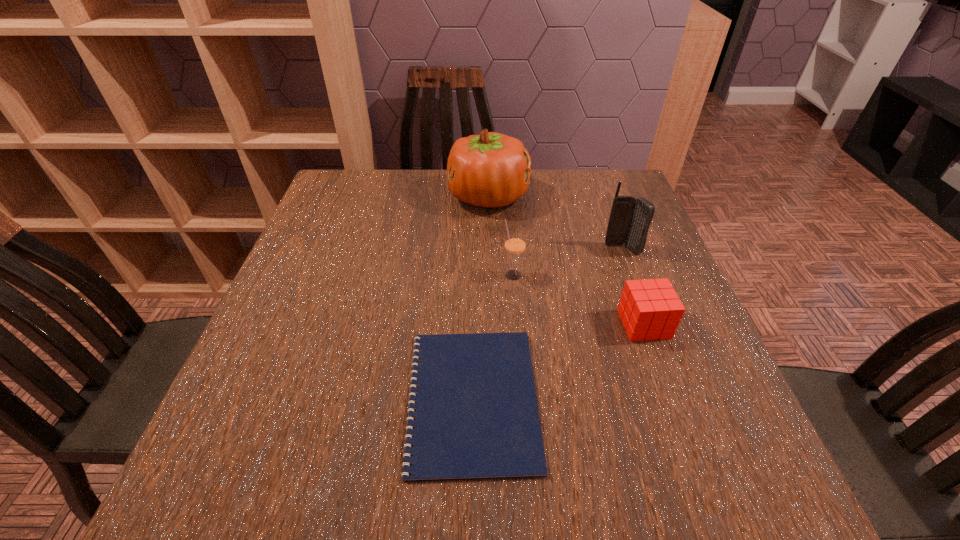
I want to click on pumpkin, so click(x=491, y=170).

Locate an element on the screen. The height and width of the screenshot is (540, 960). the second farthest object is located at coordinates (630, 219).

I want to click on the third tallest object, so click(x=515, y=243).

Locate an element on the screen. straw is located at coordinates (515, 243).

This screenshot has height=540, width=960. I want to click on cube, so click(x=650, y=309).

Identify the location of notepad. (476, 417).

The width and height of the screenshot is (960, 540). In order to click on free spot located 0.270m on the side of the farthest object with the cute face in this screenshot , I will do `click(354, 197)`.

Locate an element on the screen. The image size is (960, 540). vacant space located on the side of the farthest object with the cute face is located at coordinates (333, 197).

This screenshot has width=960, height=540. Find the location of `vacant position located on the side of the farthest object with the cute face`. vacant position located on the side of the farthest object with the cute face is located at coordinates (393, 197).

Find the location of `vacant region located on the keyboard of the fourth nearest object`. vacant region located on the keyboard of the fourth nearest object is located at coordinates pos(636,286).